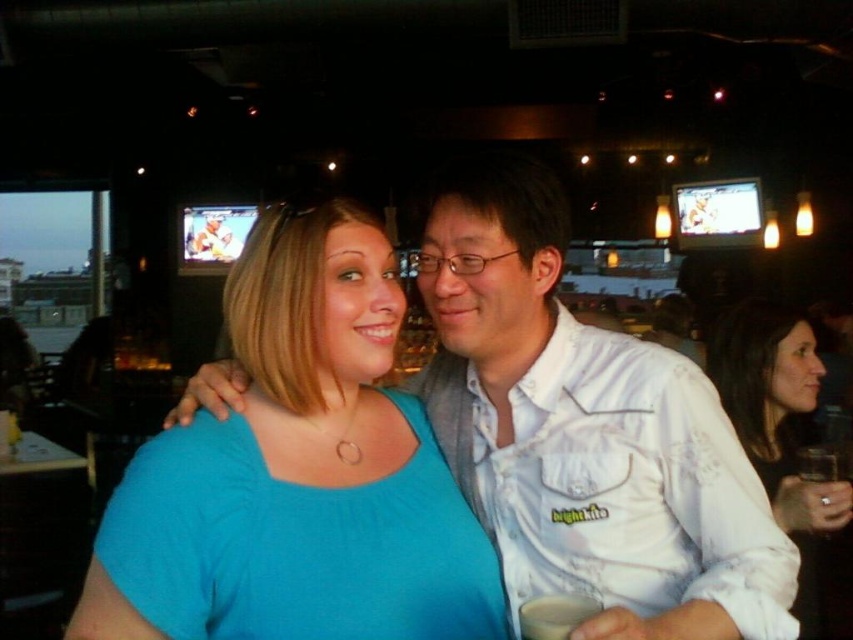
You are a photographer at a social event and need to capture a photo of the matte blue shirt at center and the white lace shirt at right. Based on their positions, which shirt should you focus on first to ensure both are in frame?

The matte blue shirt at center is to the left of the white lace shirt at right, so you should focus on the white lace shirt at right first to ensure both are in frame.

Consider the image. You are a photographer trying to capture a candid shot of both the white cotton shirt at center and the white lace shirt at right. Since you want to ensure both shirts are clearly visible in the frame, which shirt should you focus on first to ensure proper exposure?

The white cotton shirt at center should be focused on first because it is bigger than the white lace shirt at right, so it will require more precise exposure adjustments to capture its details properly.

You are a photographer trying to capture a clear shot of the white lace shirt at right. Based on the coordinates provided, where should you position your camera to ensure the shirt is centered in the frame?

The white lace shirt at right is located at coordinates point (778, 428), so you should position your camera to center the frame at those coordinates to capture it clearly.